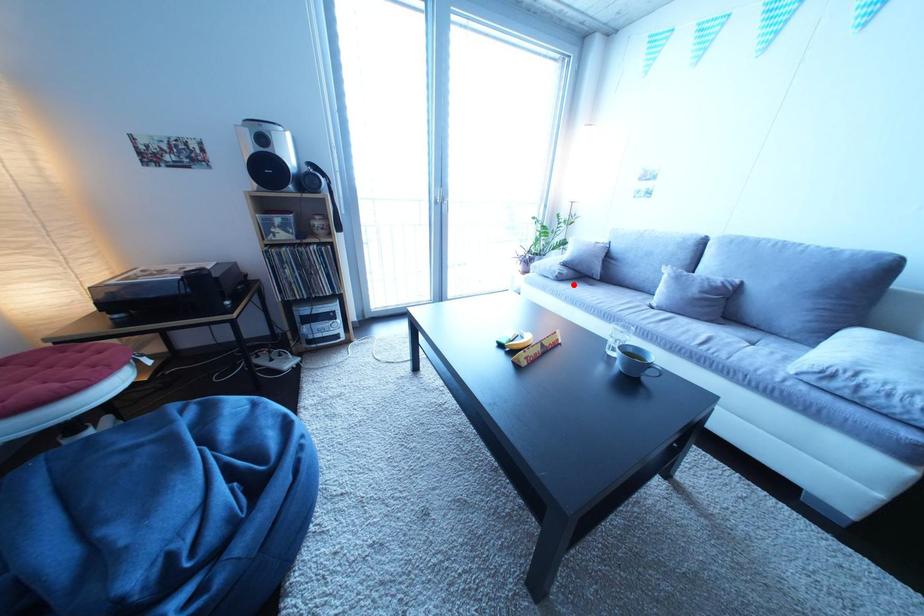
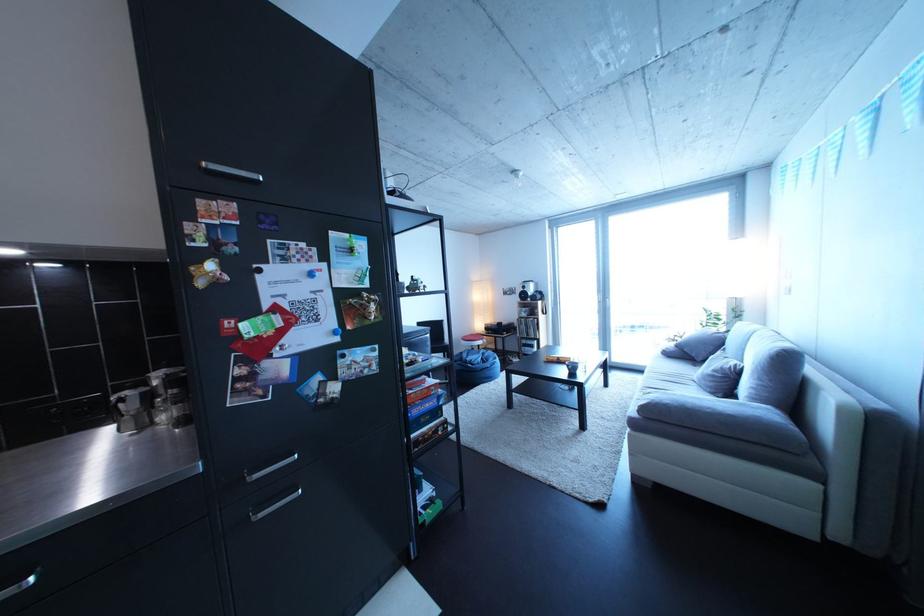
The point at the highlighted location is marked in the first image. Where is the corresponding point in the second image?

(682, 361)